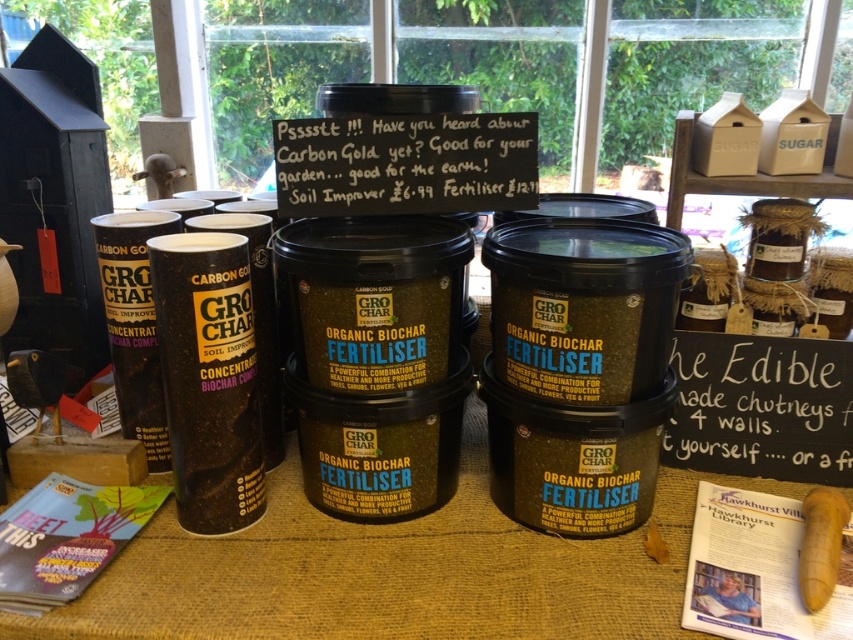
Question: Does black paper sign at center have a lesser width compared to white chalkboard sign at center?

Choices:
 (A) yes
 (B) no

Answer: (B)

Question: Is black paper sign at center positioned behind white chalkboard sign at center?

Choices:
 (A) no
 (B) yes

Answer: (A)

Question: Can you confirm if black paper sign at center is positioned to the right of white chalkboard sign at center?

Choices:
 (A) no
 (B) yes

Answer: (A)

Question: Among these points, which one is farthest from the camera?

Choices:
 (A) (496, 145)
 (B) (815, 394)

Answer: (B)

Question: Among these objects, which one is nearest to the camera?

Choices:
 (A) white chalkboard sign at center
 (B) black paper sign at center

Answer: (B)